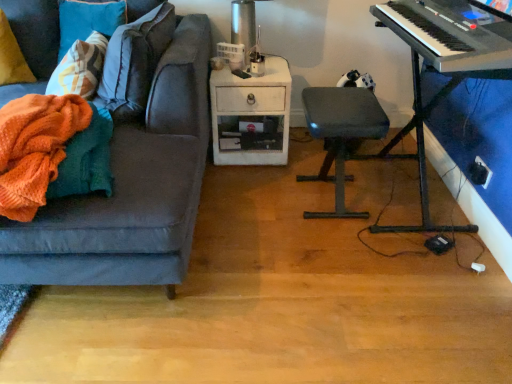
Find the location of a particular element. free location in front of matte gray stool at center is located at coordinates (329, 250).